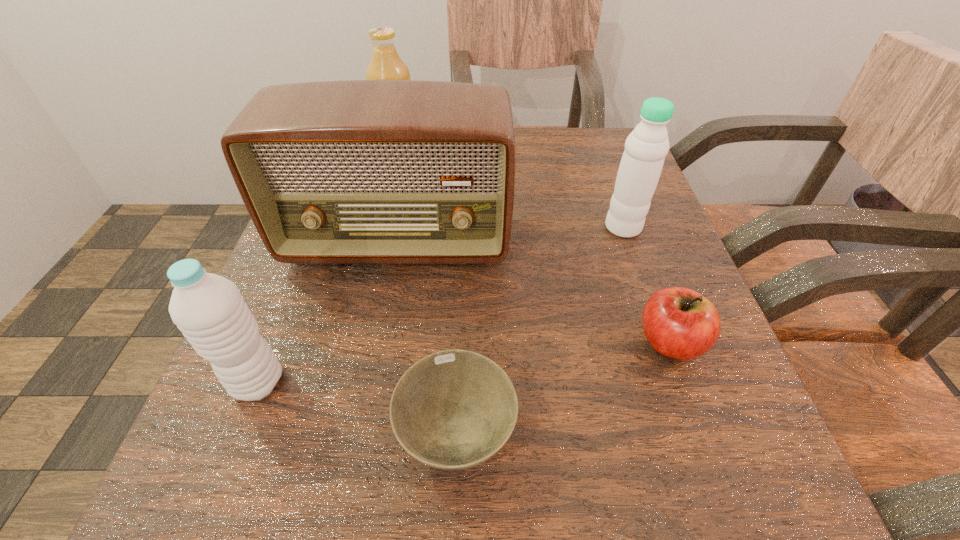
This screenshot has width=960, height=540. I want to click on vacant space at the far edge, so pyautogui.click(x=524, y=147).

Find the location of a particular element. The image size is (960, 540). free space at the near edge is located at coordinates (603, 490).

Where is `free space at the left edge of the desktop`? This screenshot has width=960, height=540. free space at the left edge of the desktop is located at coordinates (312, 327).

Find the location of `free location at the right edge of the desktop`. free location at the right edge of the desktop is located at coordinates (576, 191).

Identify the location of free space at the near left corner. The image size is (960, 540). (234, 508).

In the image, there is a desktop. At what (x,y) coordinates should I click in order to perform the action: click on free space at the far right corner. Please return your answer as a coordinate pair (x, y). This screenshot has height=540, width=960. Looking at the image, I should click on (565, 159).

The image size is (960, 540). I want to click on free space at the near right corner of the desktop, so click(783, 483).

This screenshot has height=540, width=960. What are the coordinates of `vacant area between the radio receiver and the shortest object` in the screenshot? It's located at pyautogui.click(x=427, y=339).

This screenshot has height=540, width=960. Identify the location of empty space between the second shortest object and the farther water bottle. (647, 285).

Locate an element on the screen. The width and height of the screenshot is (960, 540). vacant area between the apple and the right water bottle is located at coordinates (647, 285).